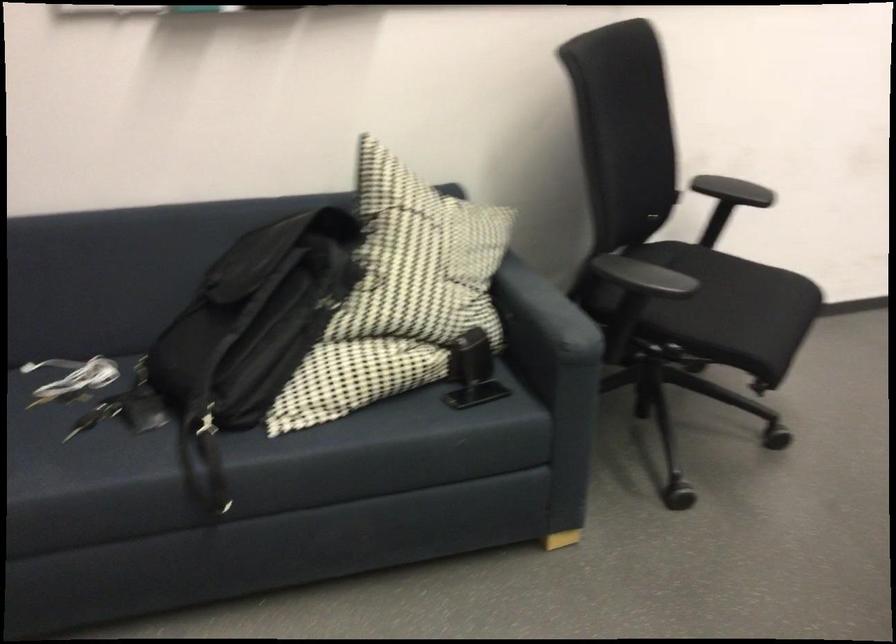
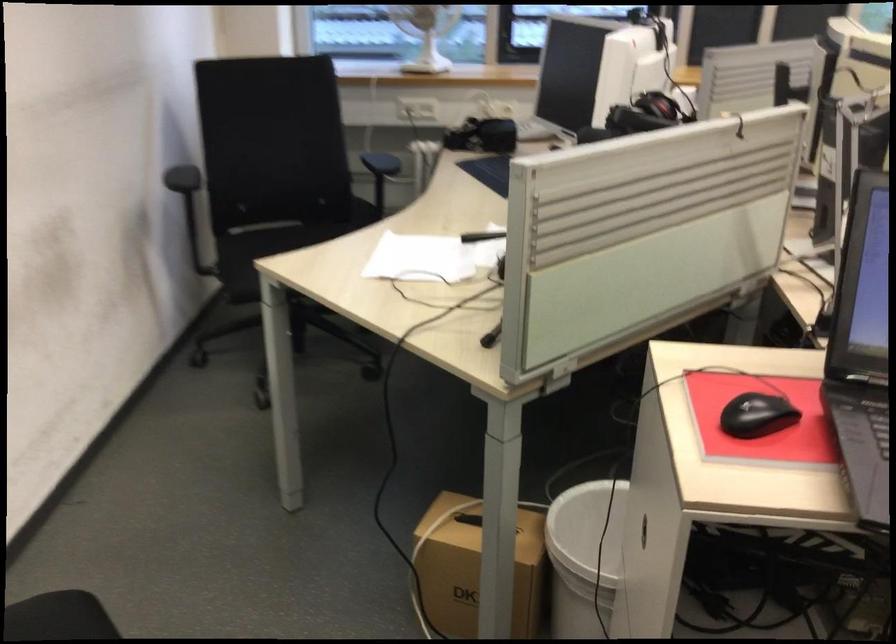
Question: How did the camera likely rotate?

Choices:
 (A) Left
 (B) Right
 (C) Up
 (D) Down

Answer: (B)